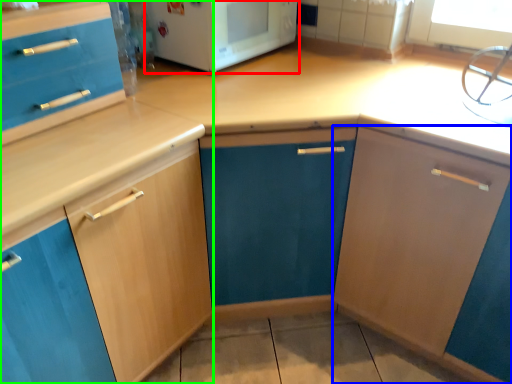
Question: Which is farther away from home appliance (highlighted by a red box)? cabinetry (highlighted by a blue box) or cabinetry (highlighted by a green box)?

Choices:
 (A) cabinetry
 (B) cabinetry

Answer: (A)